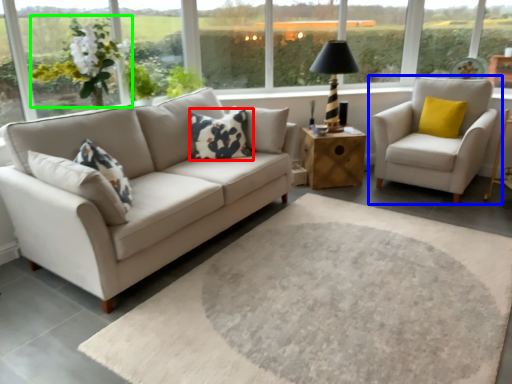
Question: Which object is positioned farthest from pillow (highlighted by a red box)? Select from chair (highlighted by a blue box) and flower (highlighted by a green box).

Choices:
 (A) chair
 (B) flower

Answer: (A)